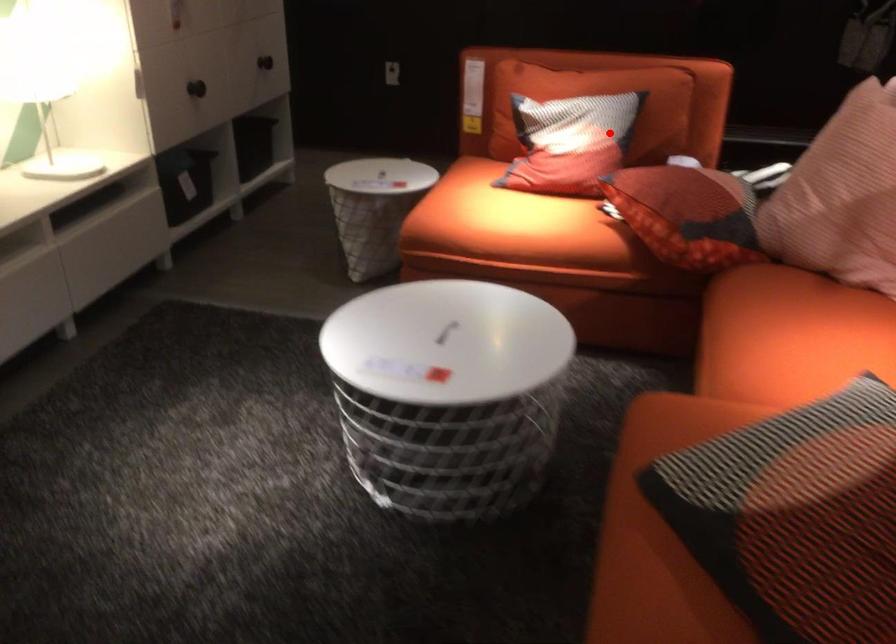
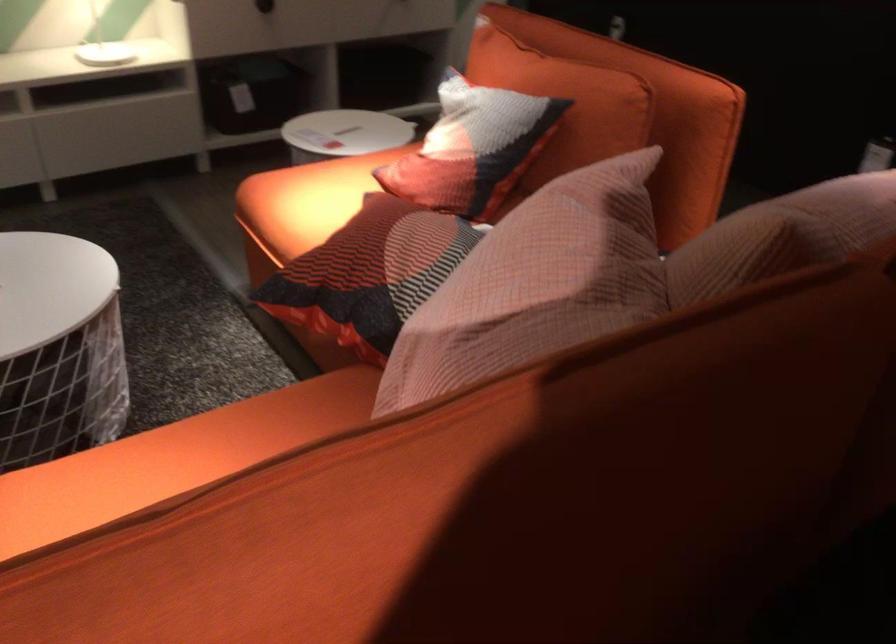
Where in the second image is the point corresponding to the highlighted location from the first image?

(472, 147)